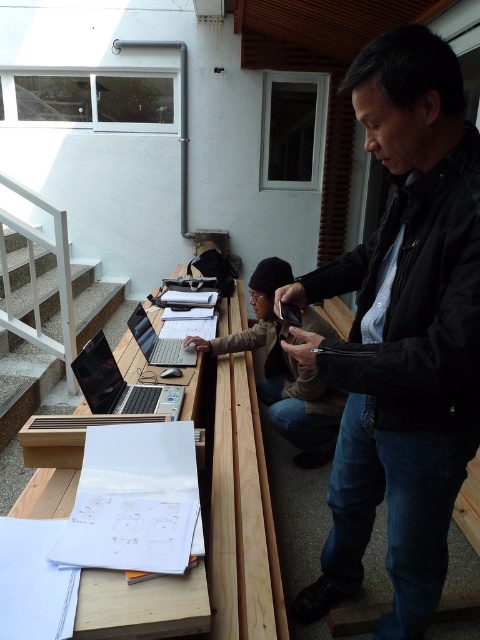
Question: Which point is farther to the camera?

Choices:
 (A) matte silver laptop at center
 (B) wooden stairs at left
 (C) wooden table at center

Answer: (B)

Question: Among these points, which one is farthest from the camera?

Choices:
 (A) (16, 358)
 (B) (108, 388)
 (C) (256, 564)
 (D) (420, 38)

Answer: (A)

Question: Is black leather jacket at center in front of wooden table at center?

Choices:
 (A) yes
 (B) no

Answer: (B)

Question: Can you confirm if black leather jacket at center is positioned to the right of matte silver laptop at center?

Choices:
 (A) yes
 (B) no

Answer: (A)

Question: Can you confirm if black leather jacket at center is bigger than wooden desk at center?

Choices:
 (A) yes
 (B) no

Answer: (B)

Question: Among these points, which one is nearest to the camera?

Choices:
 (A) (41, 380)
 (B) (117, 381)
 (C) (135, 316)
 (D) (332, 428)

Answer: (B)